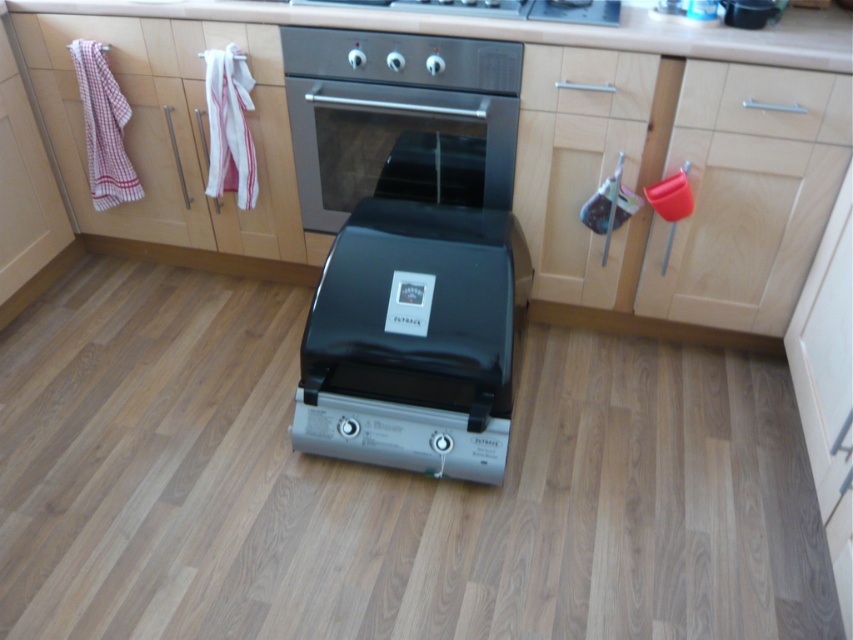
You are a kitchen designer planning to install a new 28 inch wide appliance between the stainless steel oven at center and the silver metallic drawer at center. Can the appliance fit in the space between them?

The stainless steel oven at center and silver metallic drawer at center are 31.30 inches apart. Since the new appliance is 28 inches wide, it can fit in the space between them as 31.30 inches is wider than 28 inches.

You are organizing the kitchen and need to place a new spice rack. The wooden drawer at center and the satin silver oven at upper center are in the way. Which object should you move to free up more space?

The satin silver oven at upper center occupies more space than the wooden drawer at center, so you should move the satin silver oven at upper center to free up more space.

You are a chef preparing to place a 7.5 inch wide cutting board on the kitchen countertop. The wooden drawer at center and the satin silver oven at upper center are in the way. Can you fit the cutting board between them?

The wooden drawer at center and the satin silver oven at upper center are 7.56 inches apart. Since the cutting board is 7.5 inches wide, it should fit with a small amount of space remaining between them.